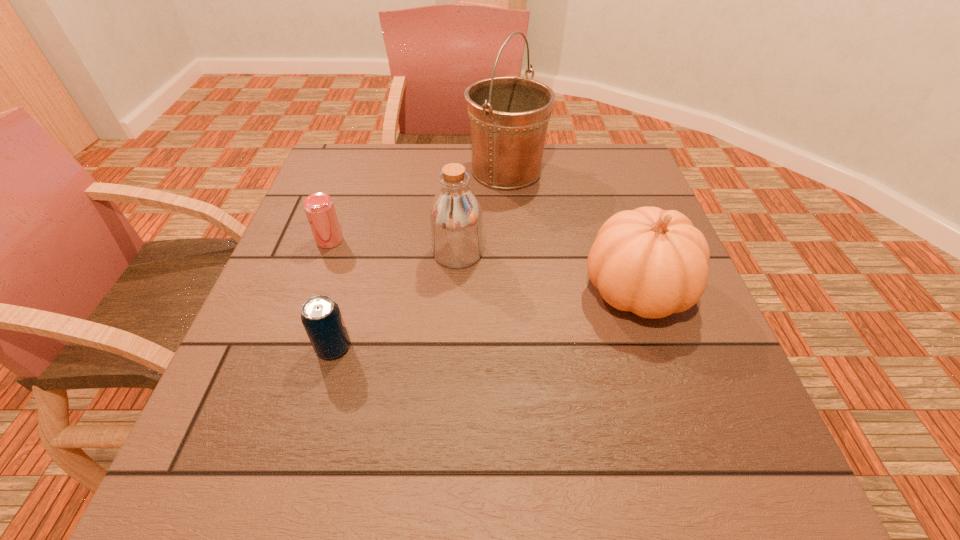
Select which object appears as the second closest to the soda can. Please provide its 2D coordinates. Your answer should be formatted as a tuple, i.e. [(x, y)], where the tuple contains the x and y coordinates of a point satisfying the conditions above.

[(319, 208)]

Select which object is the fourth closest to the tallest object. Please provide its 2D coordinates. Your answer should be formatted as a tuple, i.e. [(x, y)], where the tuple contains the x and y coordinates of a point satisfying the conditions above.

[(321, 317)]

Find the location of a particular element. The width and height of the screenshot is (960, 540). blank space that satisfies the following two spatial constraints: 1. on the back side of the tallest object; 2. on the right side of the beer can is located at coordinates (354, 171).

Where is `vacant space that satisfies the following two spatial constraints: 1. on the back side of the bottle; 2. on the left side of the soda can`? The width and height of the screenshot is (960, 540). vacant space that satisfies the following two spatial constraints: 1. on the back side of the bottle; 2. on the left side of the soda can is located at coordinates (360, 253).

The height and width of the screenshot is (540, 960). I want to click on free space that satisfies the following two spatial constraints: 1. on the front side of the rightmost object; 2. on the right side of the tallest object, so click(x=515, y=290).